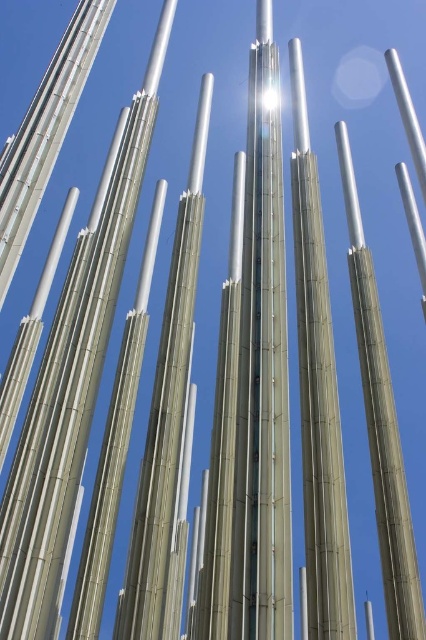
You are standing in front of the architectural structure made of metallic poles. There are two points marked on the structure. The first is at point [264,104] and the second at point [62,336]. Which point is closer to you?

Point [264,104] is in front of point [62,336], so the first point is closer to you.

You are standing in front of the metallic pole structure and want to take a photo. You notice two points marked as point (45,432) and point (383,442). Which point will appear larger in your camera view?

Point (45,432) will appear larger in the camera view because it is closer to the camera than point (383,442).

You are an architect designing a new installation and need to place a decorative sculpture between the silver bamboo pole at center and the satin silver pole at center. The sculpture requires a minimum of 25 feet of space to ensure safety. Based on the scene description, can the sculpture be safely placed between them?

The distance between the silver bamboo pole at center and the satin silver pole at center is 24.98 feet, which is slightly less than the required 25 feet. Therefore, placing the sculpture between them may not meet the safety requirement due to insufficient space.